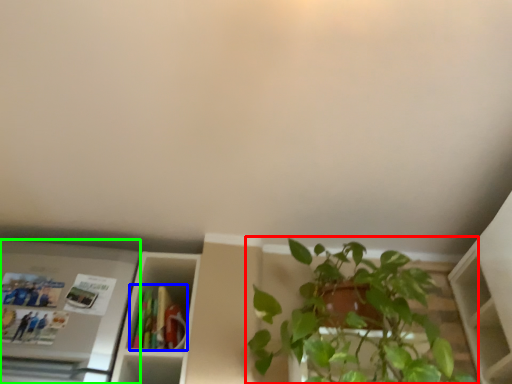
Question: Considering the real-world distances, which object is closest to houseplant (highlighted by a red box)? book (highlighted by a blue box) or appliance (highlighted by a green box).

Choices:
 (A) book
 (B) appliance

Answer: (A)